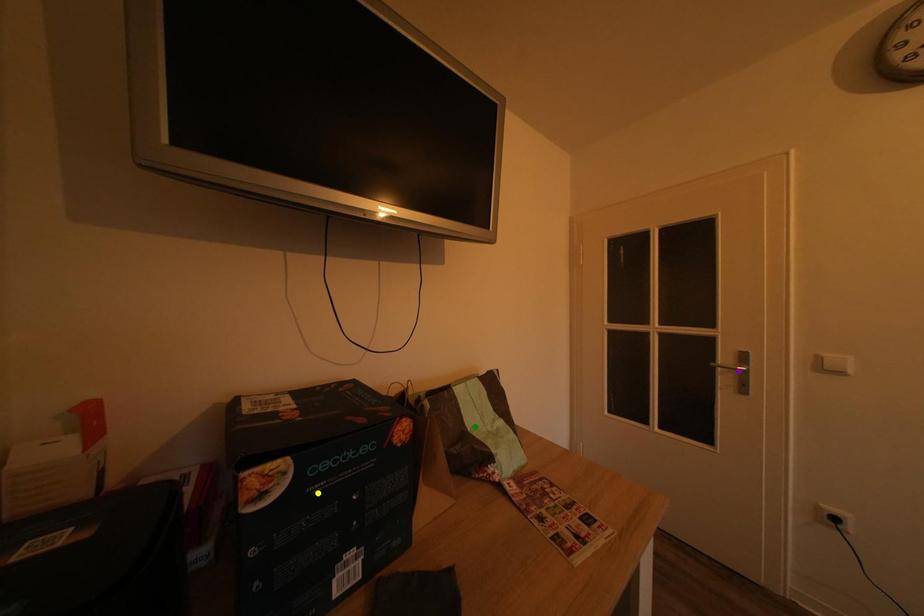
Order these from nearest to farthest:
purple point
green point
yellow point

yellow point
green point
purple point